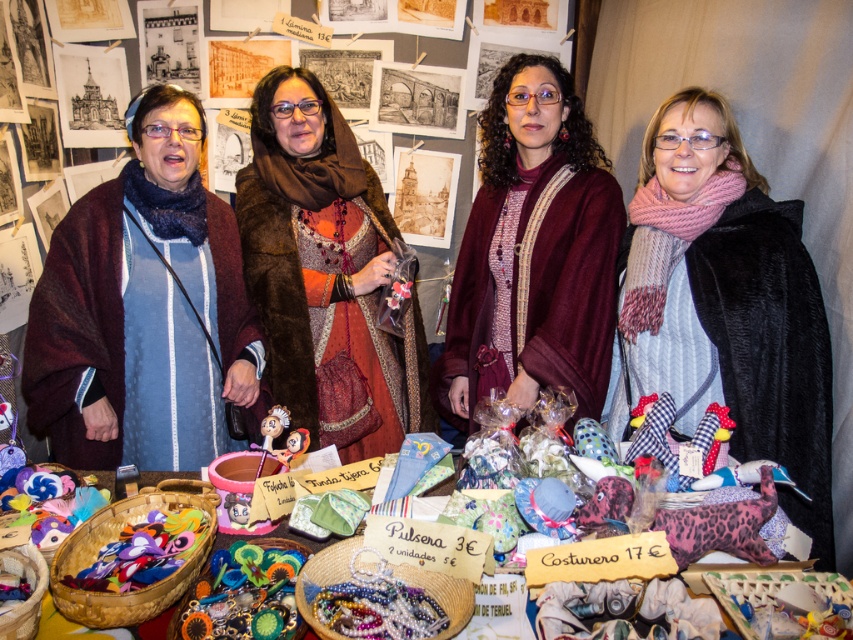
Question: Which point appears farthest from the camera in this image?

Choices:
 (A) (247, 358)
 (B) (161, 488)
 (C) (756, 262)

Answer: (A)

Question: Which of the following is the closest to the observer?

Choices:
 (A) (316, 269)
 (B) (699, 266)

Answer: (B)

Question: Can you confirm if brown fur coat at center is positioned above brightly colored felt crafts at center?

Choices:
 (A) yes
 (B) no

Answer: (A)

Question: Is maroon woolen sweater at center to the left of brown fur coat at center from the viewer's perspective?

Choices:
 (A) no
 (B) yes

Answer: (A)

Question: Is maroon woolen sweater at center below brown fur coat at center?

Choices:
 (A) yes
 (B) no

Answer: (B)

Question: Among these objects, which one is nearest to the camera?

Choices:
 (A) maroon woolen sweater at center
 (B) maroon woolen shawl at left

Answer: (B)